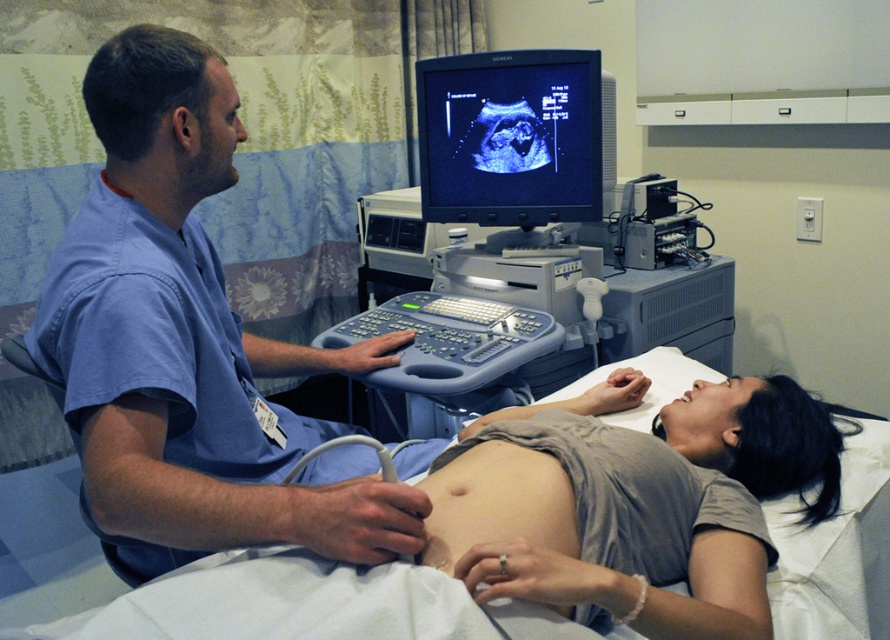
Question: Which of these objects is positioned closest to the gray plastic ultrasound machine at center?

Choices:
 (A) black glossy monitor at upper center
 (B) smooth skin at center

Answer: (A)

Question: Is blue scrubs at center in front of white fabric hospital bed at center?

Choices:
 (A) yes
 (B) no

Answer: (B)

Question: Which object is the farthest from the gray plastic ultrasound machine at center?

Choices:
 (A) blue scrubs at center
 (B) black glossy monitor at upper center
 (C) smooth skin at center
 (D) white fabric hospital bed at center

Answer: (D)

Question: Does gray plastic ultrasound machine at center lie in front of smooth skin at center?

Choices:
 (A) yes
 (B) no

Answer: (B)

Question: Among these objects, which one is farthest from the camera?

Choices:
 (A) smooth skin at center
 (B) gray plastic ultrasound machine at center

Answer: (B)

Question: Considering the relative positions of white fabric hospital bed at center and gray plastic ultrasound machine at center in the image provided, where is white fabric hospital bed at center located with respect to gray plastic ultrasound machine at center?

Choices:
 (A) right
 (B) left

Answer: (A)